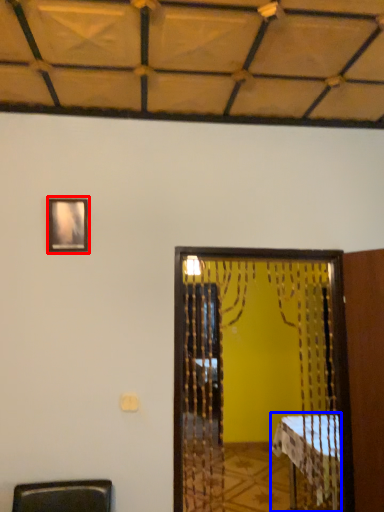
Question: Which object appears closest to the camera in this image, picture frame (highlighted by a red box) or table (highlighted by a blue box)?

Choices:
 (A) picture frame
 (B) table

Answer: (A)